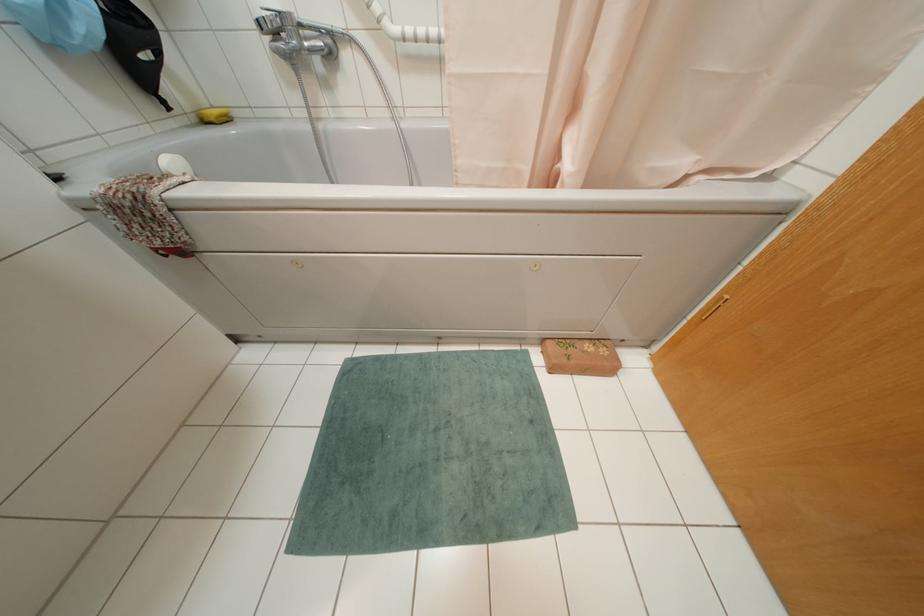
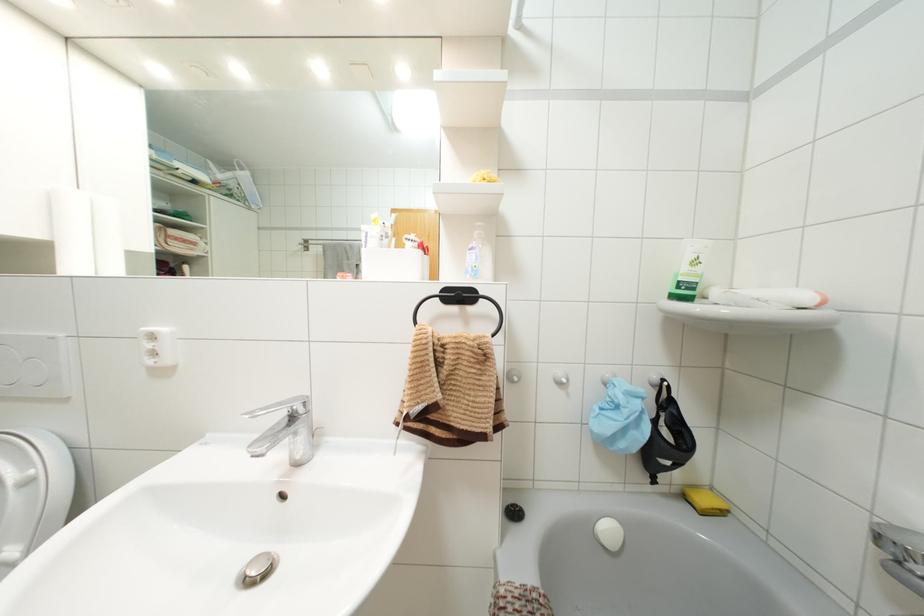
In the second image, find the point that corresponds to point 202,121 in the first image.

(685, 496)